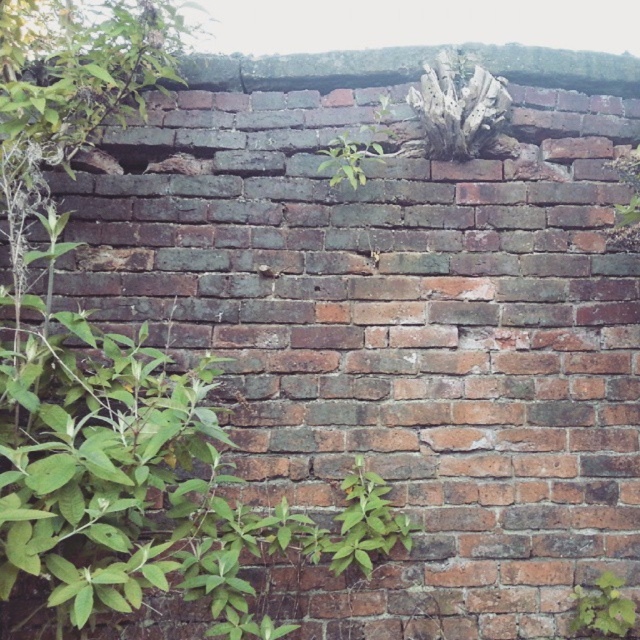
You are a gardener who needs to water two green leafy plants. The plants are the green leafy plant at lower right and the green leafy plant at center. You have a watering can that can reach 70 centimeters. Can you water both plants without moving the watering can?

The green leafy plant at lower right is 69.92 centimeters away from the green leafy plant at center. Since the watering can can reach 70 centimeters, you can water both plants without moving the watering can because the distance between them is within the reach of the watering can.

You are a gardener assessing the plants on a brick wall. You see the green leafy plant at lower right and the green leafy plant at center. Which plant has a smaller width?

The green leafy plant at lower right has a smaller width than the green leafy plant at center.